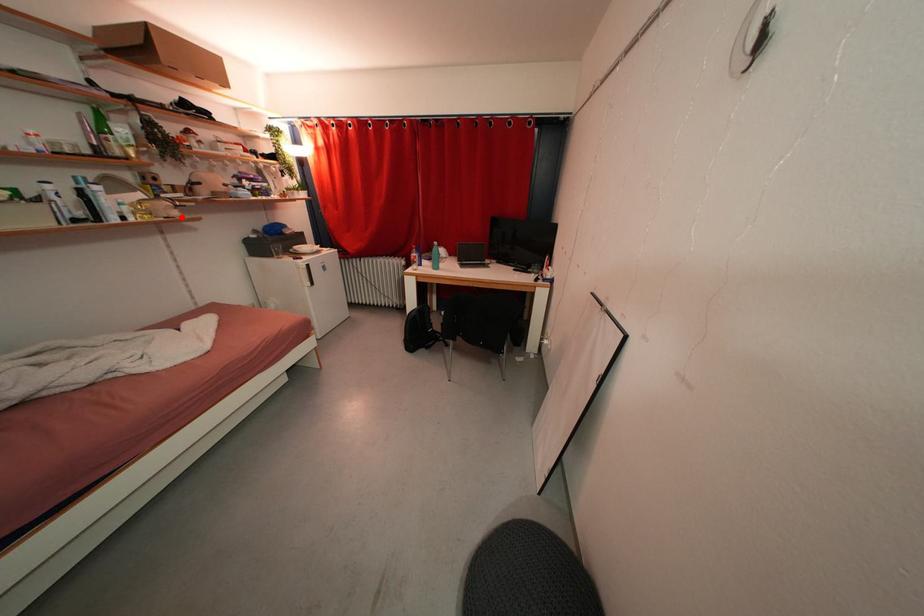
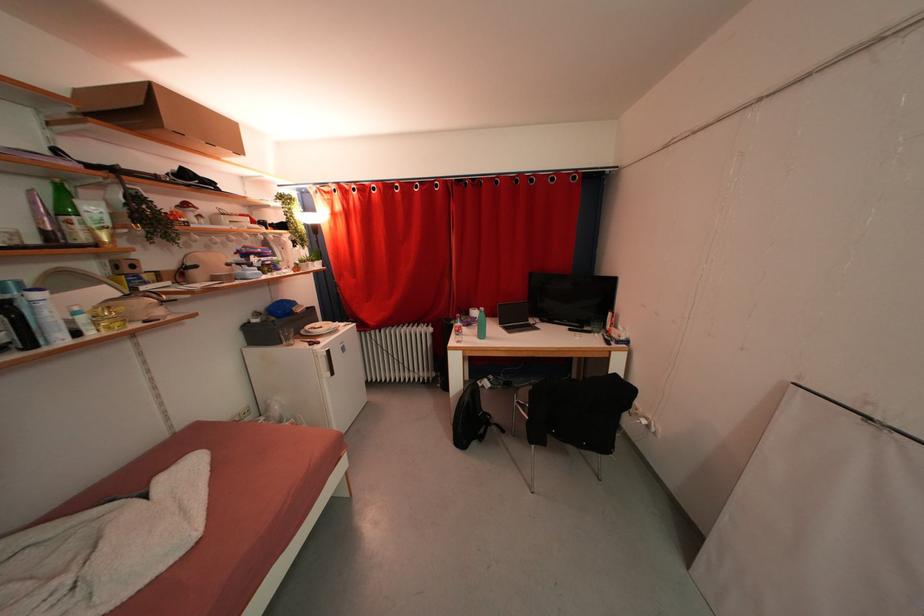
Find the pixel in the second image that matches the highlighted location in the first image.

(165, 315)